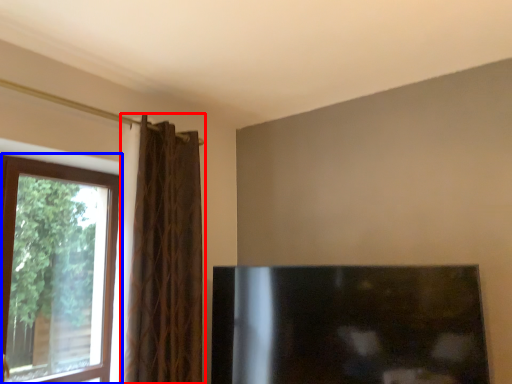
Question: Which object is further to the camera taking this photo, curtain (highlighted by a red box) or window (highlighted by a blue box)?

Choices:
 (A) curtain
 (B) window

Answer: (A)